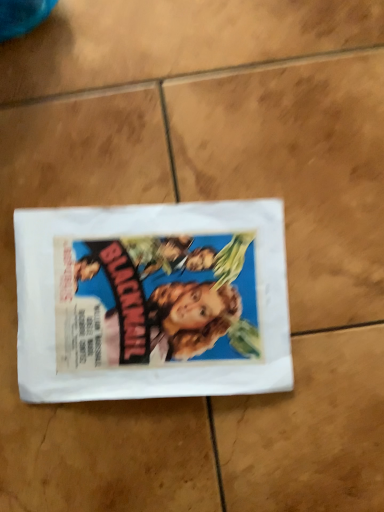
Find the location of a particular element. The width and height of the screenshot is (384, 512). free spot above white paper album at center (from a real-world perspective) is located at coordinates (143, 296).